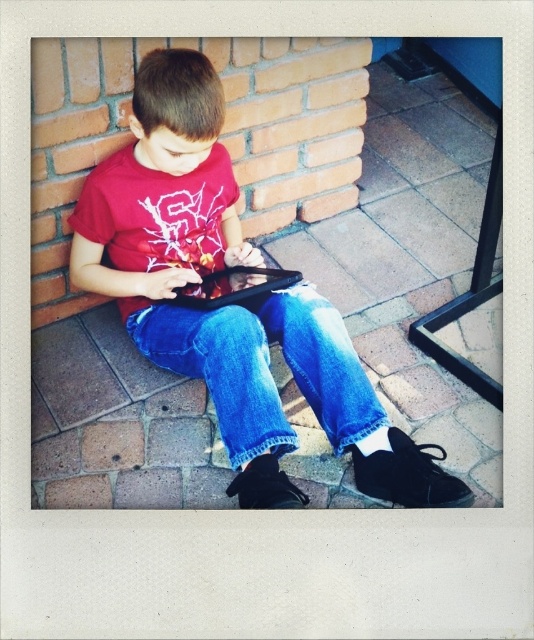
Can you confirm if matte black tablet at center is wider than black matte tablet at center?

Indeed, matte black tablet at center has a greater width compared to black matte tablet at center.

Between matte black tablet at center and black matte tablet at center, which one has less height?

With less height is black matte tablet at center.

Which is in front, point (192, 205) or point (276, 273)?

Positioned in front is point (276, 273).

Locate an element on the screen. matte black tablet at center is located at coordinates (230, 305).

Between matte black tablet at center and denim at center, which one appears on the left side from the viewer's perspective?

matte black tablet at center is more to the left.

Which is in front, point (145, 273) or point (260, 298)?

Point (260, 298) is more forward.

Which is in front, point (162, 288) or point (231, 362)?

Point (231, 362) is more forward.

The height and width of the screenshot is (640, 534). What are the coordinates of `matte black tablet at center` in the screenshot? It's located at (230, 305).

Can you confirm if denim at center is positioned above black matte tablet at center?

No, denim at center is not above black matte tablet at center.

The image size is (534, 640). In order to click on denim at center in this screenshot , I will do `click(264, 368)`.

Locate an element on the screen. This screenshot has width=534, height=640. denim at center is located at coordinates (264, 368).